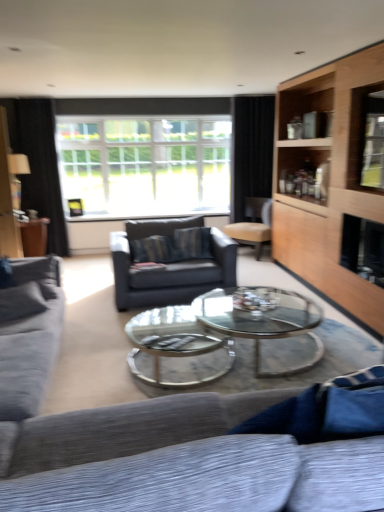
Question: From a real-world perspective, does beige leather chair at center stand above textured gray couch at left, the 2th studio couch viewed from the right?

Choices:
 (A) yes
 (B) no

Answer: (A)

Question: Is there a large distance between beige leather chair at center and textured gray couch at left, the 2th studio couch viewed from the right?

Choices:
 (A) no
 (B) yes

Answer: (B)

Question: From the image's perspective, is beige leather chair at center below textured gray couch at left, arranged as the 1th studio couch when viewed from the left?

Choices:
 (A) no
 (B) yes

Answer: (A)

Question: From the image's perspective, is beige leather chair at center located above textured gray couch at left, arranged as the 1th studio couch when viewed from the left?

Choices:
 (A) no
 (B) yes

Answer: (B)

Question: Is beige leather chair at center wider than textured gray couch at left, arranged as the 1th studio couch when viewed from the left?

Choices:
 (A) no
 (B) yes

Answer: (A)

Question: Considering their positions, is black fabric curtain at upper right, which ranks as the 2th curtain in left-to-right order, located in front of or behind light wood cabinet at right?

Choices:
 (A) behind
 (B) front

Answer: (A)

Question: From a real-world perspective, is black fabric curtain at upper right, arranged as the first curtain when viewed from the right, physically located above or below light wood cabinet at right?

Choices:
 (A) above
 (B) below

Answer: (A)

Question: Is black fabric curtain at upper right, which ranks as the 2th curtain in left-to-right order, inside or outside of light wood cabinet at right?

Choices:
 (A) outside
 (B) inside

Answer: (A)

Question: From the image's perspective, relative to light wood cabinet at right, is black fabric curtain at upper right, arranged as the first curtain when viewed from the right, above or below?

Choices:
 (A) below
 (B) above

Answer: (B)

Question: Considering the positions of point (23, 293) and point (314, 101), is point (23, 293) closer or farther from the camera than point (314, 101)?

Choices:
 (A) closer
 (B) farther

Answer: (A)

Question: From the image's perspective, is textured gray couch at left, the 2th studio couch viewed from the right, positioned above or below light wood cabinet at right?

Choices:
 (A) below
 (B) above

Answer: (A)

Question: Considering the positions of textured gray couch at left, the 2th studio couch viewed from the right, and light wood cabinet at right in the image, is textured gray couch at left, the 2th studio couch viewed from the right, wider or thinner than light wood cabinet at right?

Choices:
 (A) thin
 (B) wide

Answer: (B)

Question: Is textured gray couch at left, arranged as the 1th studio couch when viewed from the left, spatially inside light wood cabinet at right, or outside of it?

Choices:
 (A) outside
 (B) inside

Answer: (A)

Question: Is textured gray couch at left, arranged as the 1th studio couch when viewed from the left, spatially inside textured gray couch at lower center, which is the second studio couch in left-to-right order, or outside of it?

Choices:
 (A) inside
 (B) outside

Answer: (B)

Question: Considering the positions of textured gray couch at left, arranged as the 1th studio couch when viewed from the left, and textured gray couch at lower center, which is the second studio couch in left-to-right order, in the image, is textured gray couch at left, arranged as the 1th studio couch when viewed from the left, bigger or smaller than textured gray couch at lower center, which is the second studio couch in left-to-right order,?

Choices:
 (A) small
 (B) big

Answer: (A)